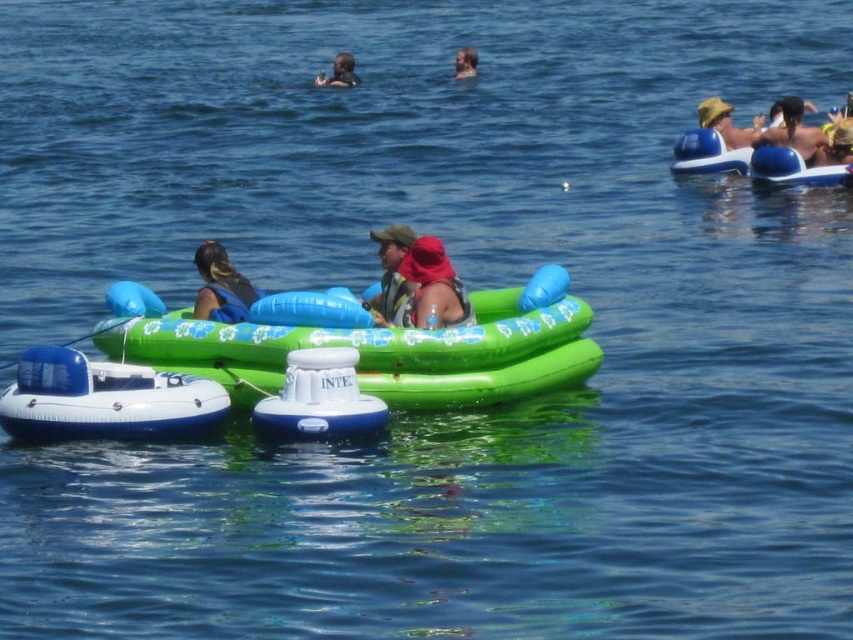
You are a photographer trying to capture a photo of the green inflatable raft at center and the smooth skin face at upper center. Based on their positions, which object is located to the left of the other?

The green inflatable raft at center is positioned on the left side of smooth skin face at upper center, so the raft is to the left of the face.

You are a lifeguard on duty and need to reach the smooth skin face at upper center from the green inflatable raft at center. Given that your swimming speed is 2 meters per second, how many seconds will it take you to reach them?

The distance between the green inflatable raft at center and the smooth skin face at upper center is 268.36 feet. Converting feet to meters, 268.36 feet is approximately 81.8 meters. At a swimming speed of 2 meters per second, it would take about 40.9 seconds to reach them.

You are standing on the shore and see the green inflatable raft with blue accents and the two people on it. There is also a point marked at coordinates (318, 397). What object does this point correspond to?

The point at coordinates (318, 397) corresponds to the blue rubber boat at center.